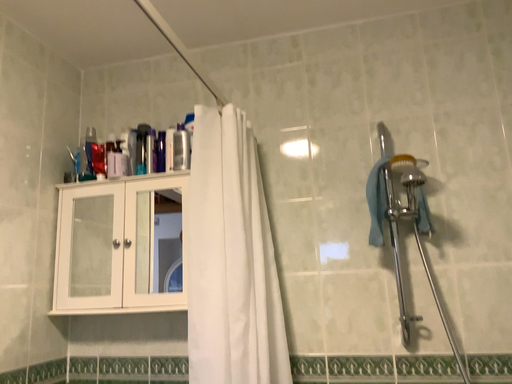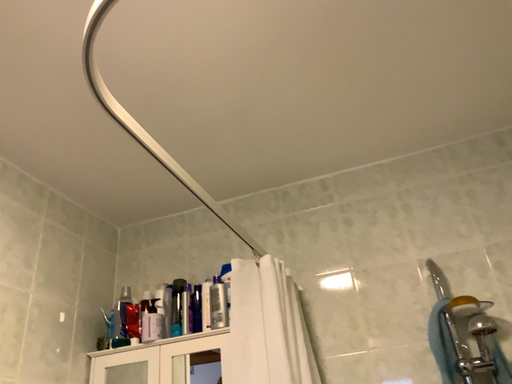
Question: How did the camera likely rotate when shooting the video?

Choices:
 (A) rotated upward
 (B) rotated downward

Answer: (A)